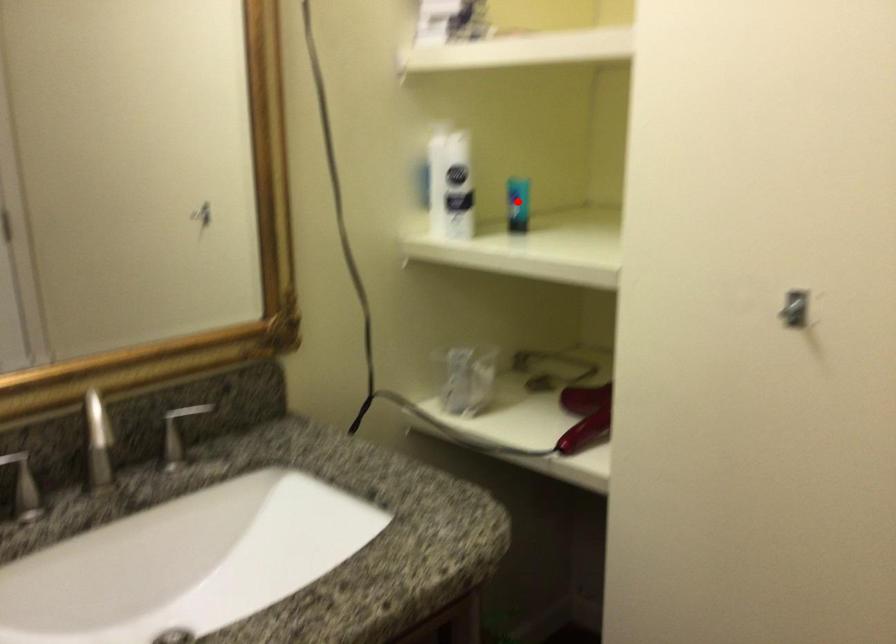
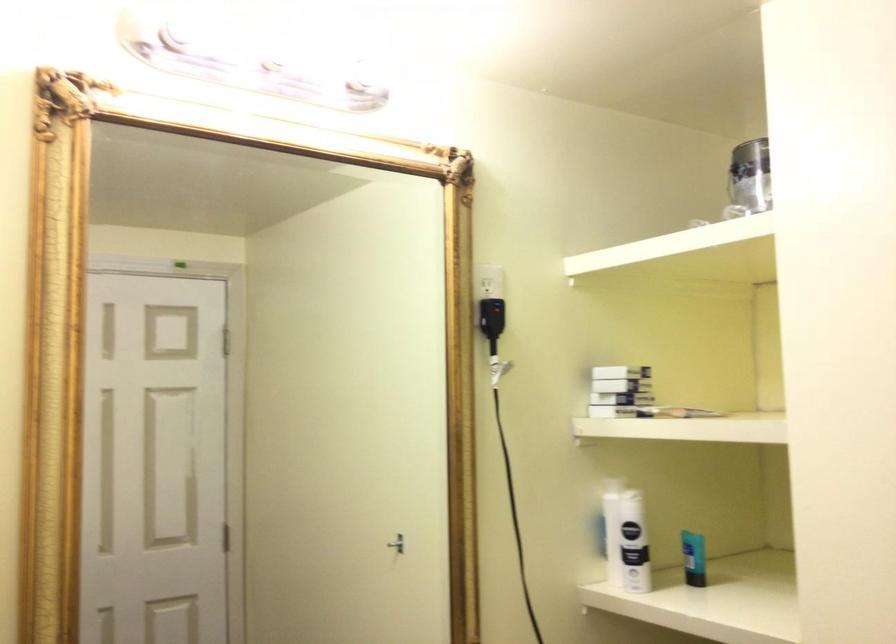
Where in the second image is the point corresponding to the highlighted location from the first image?

(693, 558)